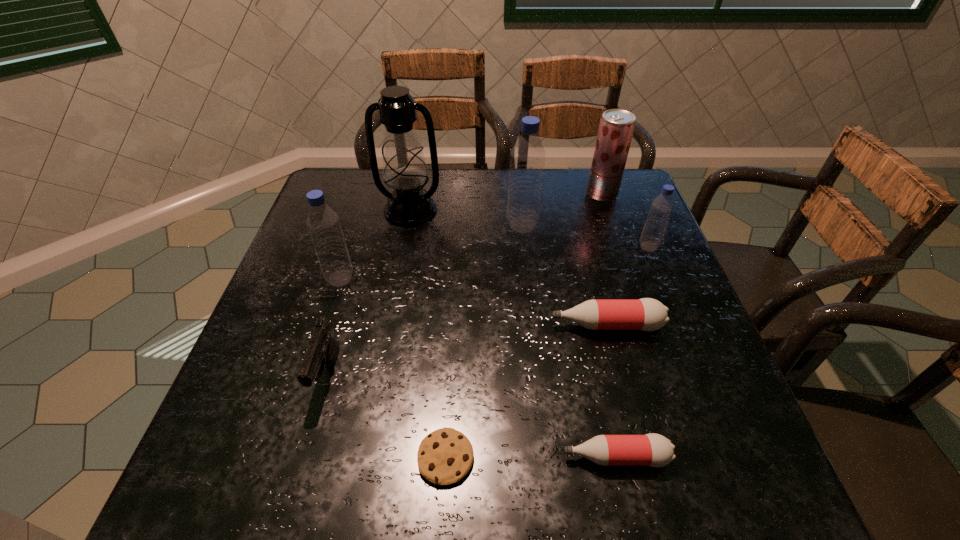
Image resolution: width=960 pixels, height=540 pixels. I want to click on free space located on the left of the leftmost bottle, so [x=292, y=278].

Find the location of a particular element. This screenshot has width=960, height=540. vacant point located on the back of the rightmost blue bottle is located at coordinates (635, 212).

The height and width of the screenshot is (540, 960). What are the coordinates of `free space located at the barrel of the third nearest object` in the screenshot? It's located at (309, 440).

Image resolution: width=960 pixels, height=540 pixels. Identify the location of free space located with the cap open on the second shortest bottle. (463, 325).

The image size is (960, 540). Identify the location of vacant space located with the cap open on the second shortest bottle. (374, 325).

Identify the location of vacant space located with the cap open on the second shortest bottle. (379, 325).

The height and width of the screenshot is (540, 960). I want to click on free space located with the cap open on the nearer pink bottle, so click(x=363, y=457).

The image size is (960, 540). I want to click on blank space located with the cap open on the nearer pink bottle, so click(x=427, y=457).

Identify the location of vacant space positioned 0.230m with the cap open on the nearer pink bottle. (x=427, y=457).

This screenshot has width=960, height=540. In order to click on vacant space located on the back of the cookie in this screenshot , I will do `click(455, 285)`.